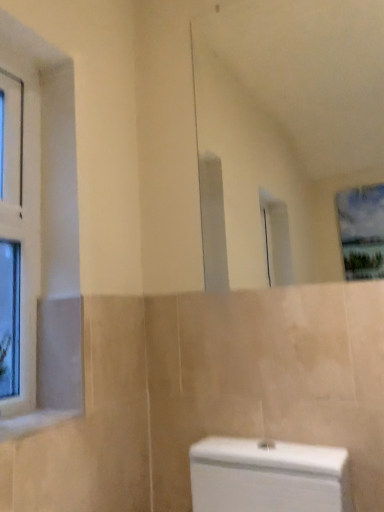
Question: From a real-world perspective, is white glossy mirror at upper center physically below clear glass window at left?

Choices:
 (A) yes
 (B) no

Answer: (B)

Question: Is there a large distance between white glossy mirror at upper center and clear glass window at left?

Choices:
 (A) yes
 (B) no

Answer: (A)

Question: Is white glossy mirror at upper center shorter than clear glass window at left?

Choices:
 (A) no
 (B) yes

Answer: (B)

Question: From the image's perspective, is white glossy mirror at upper center on clear glass window at left?

Choices:
 (A) yes
 (B) no

Answer: (A)

Question: Is white glossy mirror at upper center bigger than clear glass window at left?

Choices:
 (A) yes
 (B) no

Answer: (A)

Question: Does point (233, 105) appear closer or farther from the camera than point (11, 307)?

Choices:
 (A) farther
 (B) closer

Answer: (A)

Question: Is white glossy mirror at upper center taller or shorter than clear glass window at left?

Choices:
 (A) tall
 (B) short

Answer: (B)

Question: Which is correct: white glossy mirror at upper center is inside clear glass window at left, or outside of it?

Choices:
 (A) outside
 (B) inside

Answer: (A)

Question: Is white glossy mirror at upper center to the left or to the right of clear glass window at left in the image?

Choices:
 (A) right
 (B) left

Answer: (A)

Question: Looking at their shapes, would you say white marble window sill at lower left is wider or thinner than white glossy mirror at upper center?

Choices:
 (A) wide
 (B) thin

Answer: (A)

Question: From their relative heights in the image, would you say white marble window sill at lower left is taller or shorter than white glossy mirror at upper center?

Choices:
 (A) tall
 (B) short

Answer: (B)

Question: From the image's perspective, is white marble window sill at lower left positioned above or below white glossy mirror at upper center?

Choices:
 (A) above
 (B) below

Answer: (B)

Question: Would you say white marble window sill at lower left is inside or outside white glossy mirror at upper center?

Choices:
 (A) inside
 (B) outside

Answer: (B)

Question: Is clear glass window at left inside or outside of white glossy mirror at upper center?

Choices:
 (A) inside
 (B) outside

Answer: (B)

Question: From their relative heights in the image, would you say clear glass window at left is taller or shorter than white glossy mirror at upper center?

Choices:
 (A) short
 (B) tall

Answer: (B)